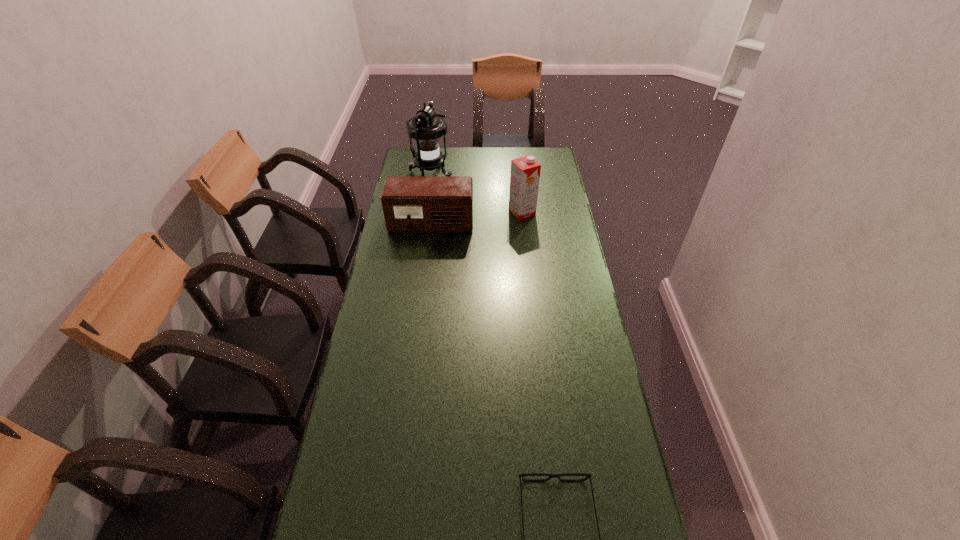
Where is `the farthest object`? The image size is (960, 540). the farthest object is located at coordinates (427, 127).

Identify the location of the tallest object. Image resolution: width=960 pixels, height=540 pixels. (427, 127).

Where is `the third shortest object`? This screenshot has height=540, width=960. the third shortest object is located at coordinates (525, 171).

The image size is (960, 540). Identify the location of the third tallest object. coord(410,204).

Find the location of a particular element. This screenshot has height=540, width=960. free region located on the front of the tallest object is located at coordinates (423, 226).

Find the location of `vacant point located 0.240m on the front of the second tallest object`. vacant point located 0.240m on the front of the second tallest object is located at coordinates (527, 260).

Locate an element on the screen. This screenshot has width=960, height=540. free spot located on the front-facing side of the third tallest object is located at coordinates (420, 305).

You are a GUI agent. You are given a task and a screenshot of the screen. Output one action in this format:
    pyautogui.click(x=<x>, y=<y>)
    Task: Click on the object situated at the far edge
    The image size is (960, 540).
    Given the screenshot: What is the action you would take?
    pyautogui.click(x=427, y=127)

The width and height of the screenshot is (960, 540). I want to click on lantern positioned at the left edge, so click(427, 127).

Image resolution: width=960 pixels, height=540 pixels. Identify the location of radio receiver that is positioned at the left edge. point(410,204).